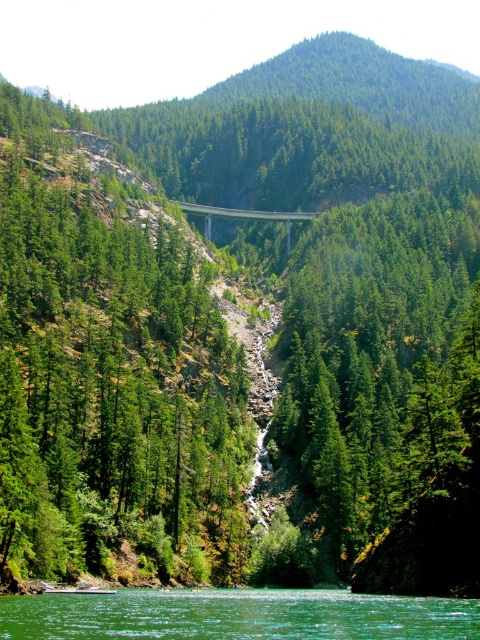
You are standing at the camera position observing the landscape. There are two points marked in the image, point (433,614) and point (241,220). Which point is closer to you?

Point (433,614) is closer to the camera than point (241,220).

You are standing at the point labeled as point [237,616] in the image. What does this point represent in the serene natural landscape?

The point [237,616] corresponds to the green smooth water at lower center in the scene.